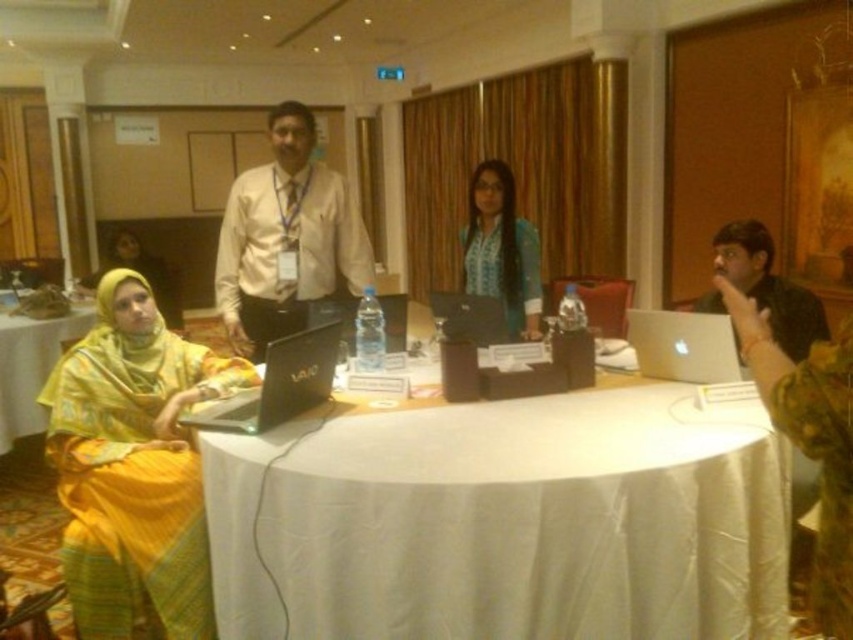
Question: Which of the following is the farthest from the observer?

Choices:
 (A) black matte laptop at right
 (B) white satin tablecloth at center
 (C) matte white shirt at center
 (D) white cloth table at lower left

Answer: (D)

Question: Which point is closer to the camera?

Choices:
 (A) silver metallic laptop at center
 (B) yellow satin hijab at lower left
 (C) white cloth table at lower left

Answer: (A)

Question: Does matte white shirt at center lie behind white cloth table at lower left?

Choices:
 (A) yes
 (B) no

Answer: (B)

Question: Does white satin tablecloth at center have a larger size compared to black matte laptop at center?

Choices:
 (A) yes
 (B) no

Answer: (A)

Question: Which is farther from the white satin tablecloth at center?

Choices:
 (A) black matte laptop at center
 (B) white cloth table at lower left

Answer: (B)

Question: Is the position of matte white shirt at center more distant than that of silver metallic laptop at center?

Choices:
 (A) yes
 (B) no

Answer: (A)